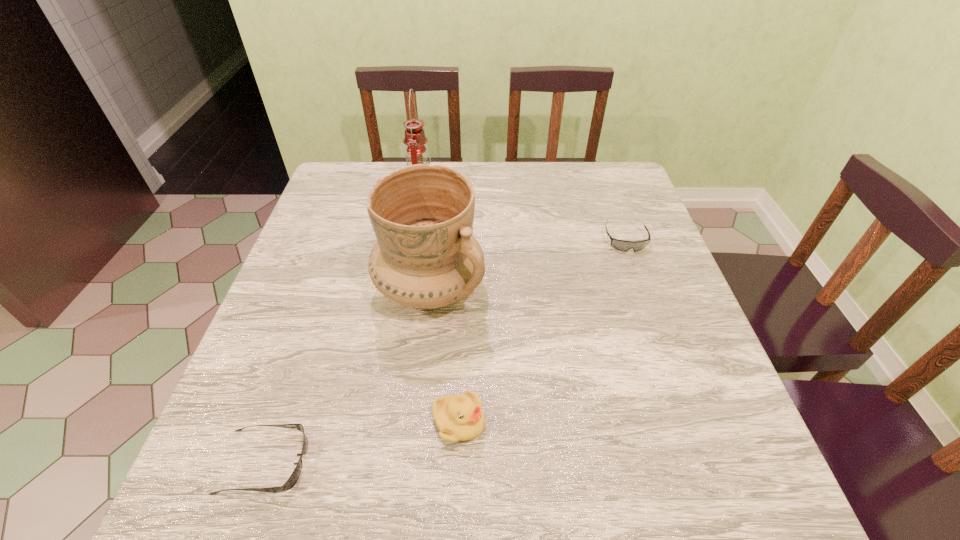
This screenshot has width=960, height=540. Find the location of `the farthest object`. the farthest object is located at coordinates 415,139.

This screenshot has width=960, height=540. I want to click on pottery, so click(x=425, y=257).

The height and width of the screenshot is (540, 960). I want to click on the third shortest object, so click(x=460, y=417).

Locate an element on the screen. goggles is located at coordinates (622, 245).

The width and height of the screenshot is (960, 540). I want to click on the leftmost object, so click(292, 480).

Where is `the shortest object`? Image resolution: width=960 pixels, height=540 pixels. the shortest object is located at coordinates (292, 480).

Image resolution: width=960 pixels, height=540 pixels. Find the location of `vacant region located on the front of the farthest object`. vacant region located on the front of the farthest object is located at coordinates (413, 235).

Find the location of a particular element. vacant space located 0.110m on the left of the pottery is located at coordinates [326, 288].

Identify the location of vacant space situated 0.120m on the front-facing side of the third shortest object. (554, 422).

Identify the location of vacant space situated 0.210m on the lenses of the rightmost object. The image size is (960, 540). (655, 320).